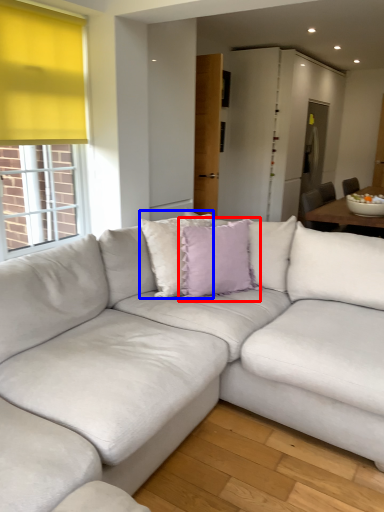
Question: Among these objects, which one is farthest to the camera, pillow (highlighted by a red box) or pillow (highlighted by a blue box)?

Choices:
 (A) pillow
 (B) pillow

Answer: (A)